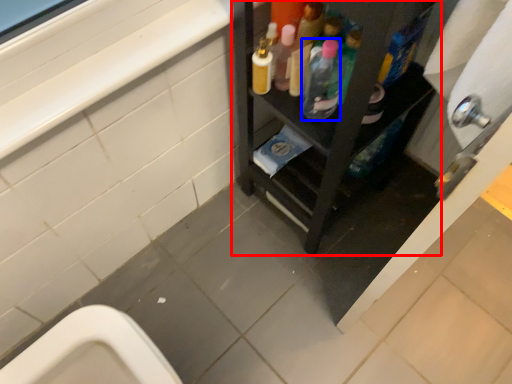
Question: Which object is further to the camera taking this photo, furniture (highlighted by a red box) or bottle (highlighted by a blue box)?

Choices:
 (A) furniture
 (B) bottle

Answer: (B)